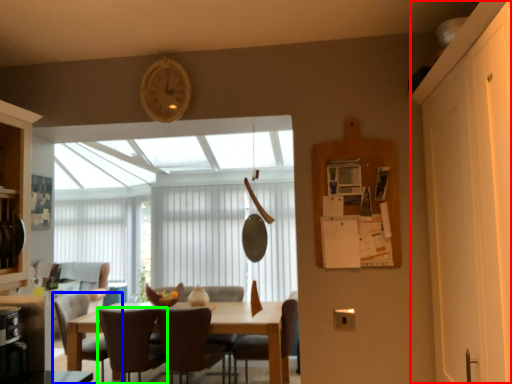
Question: Estimate the real-world distances between objects in this image. Which object is closer to screen door (highlighted by a red box), chair (highlighted by a blue box) or chair (highlighted by a green box)?

Choices:
 (A) chair
 (B) chair

Answer: (B)